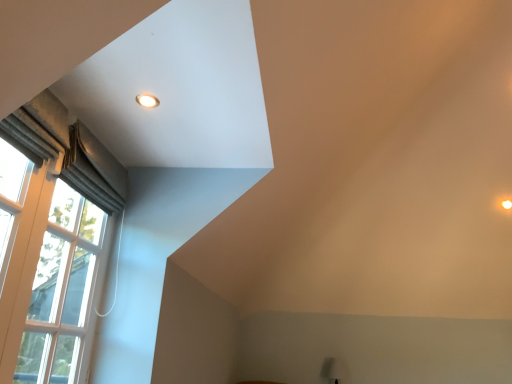
Question: Is matte white table lamp at lower right shorter than satin grey curtain at left?

Choices:
 (A) no
 (B) yes

Answer: (A)

Question: Considering the relative sizes of matte white table lamp at lower right and satin grey curtain at left in the image provided, is matte white table lamp at lower right bigger than satin grey curtain at left?

Choices:
 (A) no
 (B) yes

Answer: (A)

Question: Is matte white table lamp at lower right facing towards satin grey curtain at left?

Choices:
 (A) no
 (B) yes

Answer: (A)

Question: Is matte white table lamp at lower right at the right side of satin grey curtain at left?

Choices:
 (A) yes
 (B) no

Answer: (A)

Question: From the image's perspective, is matte white table lamp at lower right located beneath satin grey curtain at left?

Choices:
 (A) yes
 (B) no

Answer: (A)

Question: From the image's perspective, relative to matte white table lamp at lower right, is white textured curtain at left above or below?

Choices:
 (A) above
 (B) below

Answer: (A)

Question: Considering the positions of white textured curtain at left and matte white table lamp at lower right in the image, is white textured curtain at left taller or shorter than matte white table lamp at lower right?

Choices:
 (A) short
 (B) tall

Answer: (B)

Question: From a real-world perspective, is white textured curtain at left positioned above or below matte white table lamp at lower right?

Choices:
 (A) above
 (B) below

Answer: (A)

Question: Considering the relative positions of white textured curtain at left and matte white table lamp at lower right in the image provided, is white textured curtain at left to the left or to the right of matte white table lamp at lower right?

Choices:
 (A) right
 (B) left

Answer: (B)

Question: From the image's perspective, is matte white light fixture at upper left located above or below satin grey curtain at left?

Choices:
 (A) below
 (B) above

Answer: (B)

Question: Choose the correct answer: Is matte white light fixture at upper left inside satin grey curtain at left or outside it?

Choices:
 (A) inside
 (B) outside

Answer: (B)

Question: Is matte white light fixture at upper left wider or thinner than satin grey curtain at left?

Choices:
 (A) wide
 (B) thin

Answer: (B)

Question: In the image, is matte white light fixture at upper left positioned in front of or behind satin grey curtain at left?

Choices:
 (A) behind
 (B) front

Answer: (B)

Question: In terms of height, does matte white light fixture at upper left look taller or shorter compared to white textured curtain at left?

Choices:
 (A) short
 (B) tall

Answer: (A)

Question: From a real-world perspective, is matte white light fixture at upper left physically located above or below white textured curtain at left?

Choices:
 (A) above
 (B) below

Answer: (A)